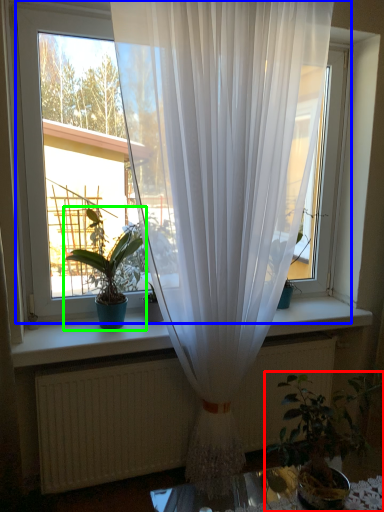
Question: Which object is the closest to the houseplant (highlighted by a red box)? Choose among these: window (highlighted by a blue box) or houseplant (highlighted by a green box).

Choices:
 (A) window
 (B) houseplant

Answer: (B)